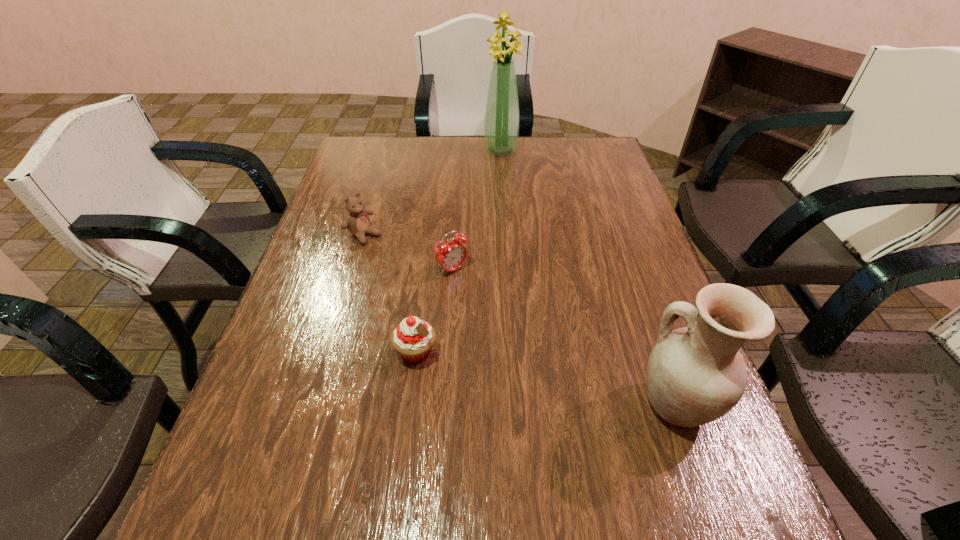
The image size is (960, 540). I want to click on free space located on the front-facing side of the tallest object, so click(505, 187).

The image size is (960, 540). What are the coordinates of `vacant area located on the front-facing side of the tallest object` in the screenshot? It's located at (509, 216).

The image size is (960, 540). In order to click on free spot located 0.210m on the front-facing side of the tallest object in this screenshot , I will do `click(506, 194)`.

This screenshot has width=960, height=540. I want to click on vacant region located 0.390m on the front-facing side of the teddy bear, so click(x=477, y=321).

Where is `free space located 0.090m on the front-facing side of the teddy bear`? The image size is (960, 540). free space located 0.090m on the front-facing side of the teddy bear is located at coordinates (396, 259).

Locate an element on the screen. The image size is (960, 540). vacant space located 0.350m on the front-facing side of the teddy bear is located at coordinates pos(466,312).

This screenshot has height=540, width=960. In order to click on vacant space located 0.180m on the face of the third farthest object in this screenshot , I will do `click(509, 323)`.

The image size is (960, 540). What are the coordinates of `free location located on the face of the third farthest object` in the screenshot? It's located at (577, 388).

The image size is (960, 540). I want to click on vacant space located on the face of the third farthest object, so click(x=490, y=304).

Find the location of a particular element. The image size is (960, 540). object located at the far edge is located at coordinates (501, 124).